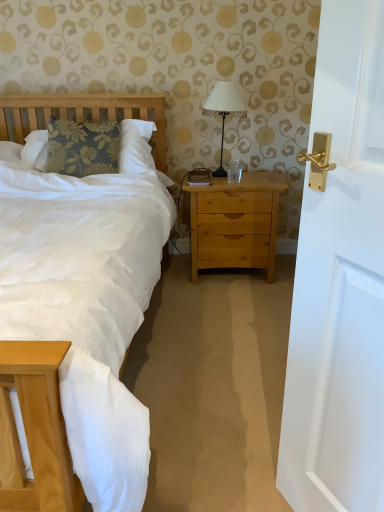
What do you see at coordinates (235, 223) in the screenshot? Image resolution: width=384 pixels, height=512 pixels. I see `light brown wood nightstand at center` at bounding box center [235, 223].

Measure the distance between point (250, 208) and camera.

Point (250, 208) and camera are 7.77 feet apart.

In order to face light brown wood nightstand at center, should I rotate leftwards or rightwards?

It's best to rotate right around 5.485 degrees.

The width and height of the screenshot is (384, 512). I want to click on light brown wood nightstand at center, so click(x=235, y=223).

I want to click on white fabric-covered lamp at upper center, so (224, 111).

What do you see at coordinates (224, 111) in the screenshot? The width and height of the screenshot is (384, 512). I see `white fabric-covered lamp at upper center` at bounding box center [224, 111].

Identify the location of light brown wood nightstand at center. (235, 223).

Which object is positioned more to the left, light brown wood nightstand at center or white fabric-covered lamp at upper center?

Positioned to the left is white fabric-covered lamp at upper center.

Considering the relative positions of light brown wood nightstand at center and white fabric-covered lamp at upper center in the image provided, is light brown wood nightstand at center in front of white fabric-covered lamp at upper center?

No, the depth of light brown wood nightstand at center is greater than that of white fabric-covered lamp at upper center.

Is point (273, 278) in front of point (228, 93)?

No, it is not.

From the image's perspective, which one is positioned higher, light brown wood nightstand at center or white fabric-covered lamp at upper center?

white fabric-covered lamp at upper center appears higher in the image.

Based on the photo, from a real-world perspective, which object stands above the other?

white fabric-covered lamp at upper center.

Does light brown wood nightstand at center have a greater width compared to white fabric-covered lamp at upper center?

Yes, light brown wood nightstand at center is wider than white fabric-covered lamp at upper center.

Can you confirm if light brown wood nightstand at center is taller than white fabric-covered lamp at upper center?

Correct, light brown wood nightstand at center is much taller as white fabric-covered lamp at upper center.

Between light brown wood nightstand at center and white fabric-covered lamp at upper center, which one has larger size?

With larger size is light brown wood nightstand at center.

Which is correct: light brown wood nightstand at center is inside white fabric-covered lamp at upper center, or outside of it?

light brown wood nightstand at center lies outside white fabric-covered lamp at upper center.

Are light brown wood nightstand at center and white fabric-covered lamp at upper center beside each other?

No, light brown wood nightstand at center is not touching white fabric-covered lamp at upper center.

Looking at this image, is light brown wood nightstand at center facing towards white fabric-covered lamp at upper center?

No, light brown wood nightstand at center is not facing towards white fabric-covered lamp at upper center.

Can you tell me how much light brown wood nightstand at center and white fabric-covered lamp at upper center differ in facing direction?

They differ by 0.507 degrees in their facing directions.

How far apart are light brown wood nightstand at center and white fabric-covered lamp at upper center?

light brown wood nightstand at center is 15.20 inches away from white fabric-covered lamp at upper center.

At what (x,y) coordinates should I click in order to perform the action: click on bedside lamp lying above the light brown wood nightstand at center (from the image's perspective). Please return your answer as a coordinate pair (x, y). Looking at the image, I should click on click(x=224, y=111).

Does white fabric-covered lamp at upper center appear on the left side of light brown wood nightstand at center?

Indeed, white fabric-covered lamp at upper center is positioned on the left side of light brown wood nightstand at center.

Considering the relative positions of white fabric-covered lamp at upper center and light brown wood nightstand at center in the image provided, is white fabric-covered lamp at upper center in front of light brown wood nightstand at center?

Yes, white fabric-covered lamp at upper center is in front of light brown wood nightstand at center.

Which is closer to the camera, (221, 148) or (193, 203)?

Point (221, 148) appears to be farther away from the viewer than point (193, 203).

From the image's perspective, is white fabric-covered lamp at upper center below light brown wood nightstand at center?

No, from the image's perspective, white fabric-covered lamp at upper center is not beneath light brown wood nightstand at center.

From a real-world perspective, which is physically below, white fabric-covered lamp at upper center or light brown wood nightstand at center?

In real-world perspective, light brown wood nightstand at center is lower.

Considering the sizes of objects white fabric-covered lamp at upper center and light brown wood nightstand at center in the image provided, who is wider, white fabric-covered lamp at upper center or light brown wood nightstand at center?

light brown wood nightstand at center.

Considering the sizes of objects white fabric-covered lamp at upper center and light brown wood nightstand at center in the image provided, who is taller, white fabric-covered lamp at upper center or light brown wood nightstand at center?

Standing taller between the two is light brown wood nightstand at center.

Which of these two, white fabric-covered lamp at upper center or light brown wood nightstand at center, is bigger?

With larger size is light brown wood nightstand at center.

Can we say white fabric-covered lamp at upper center lies outside light brown wood nightstand at center?

Yes, white fabric-covered lamp at upper center is located beyond the bounds of light brown wood nightstand at center.

Looking at this image, are white fabric-covered lamp at upper center and light brown wood nightstand at center far apart?

They are positioned close to each other.

Is white fabric-covered lamp at upper center oriented towards light brown wood nightstand at center?

No, white fabric-covered lamp at upper center is not aimed at light brown wood nightstand at center.

How different are the orientations of white fabric-covered lamp at upper center and light brown wood nightstand at center in degrees?

There is a 0.507-degree angle between the facing directions of white fabric-covered lamp at upper center and light brown wood nightstand at center.

How much distance is there between white fabric-covered lamp at upper center and light brown wood nightstand at center?

38.61 centimeters.

Locate an element on the screen. This screenshot has height=512, width=384. nightstand located below the white fabric-covered lamp at upper center (from the image's perspective) is located at coordinates (235, 223).

Image resolution: width=384 pixels, height=512 pixels. I want to click on bedside lamp in front of the light brown wood nightstand at center, so click(x=224, y=111).

Identify the location of nightstand below the white fabric-covered lamp at upper center (from the image's perspective). (235, 223).